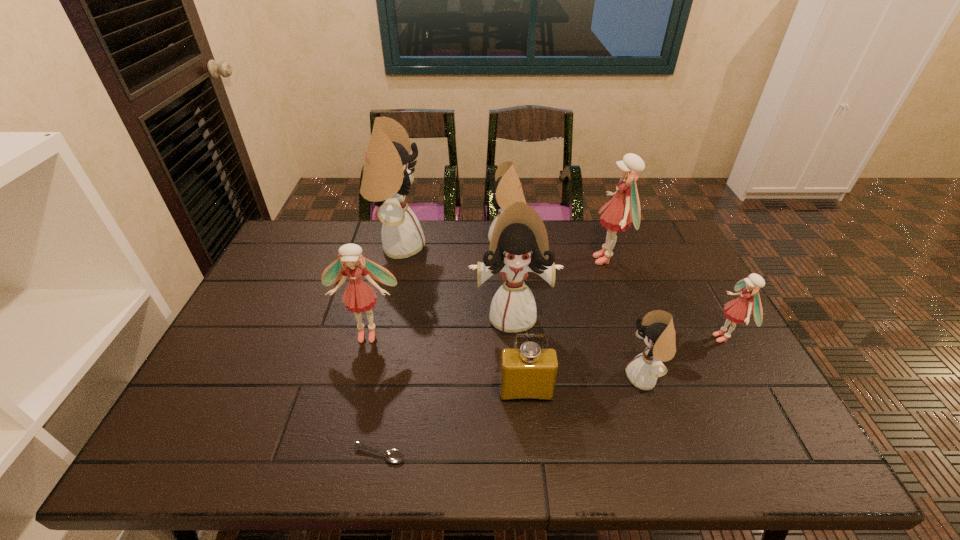
I want to click on doll that is the fourth nearest to the second shortest object, so click(624, 208).

Identify which doll is the closest to the tallest object. Please provide its 2D coordinates. Your answer should be formatted as a tuple, i.e. [(x, y)], where the tuple contains the x and y coordinates of a point satisfying the conditions above.

[(519, 244)]

Where is `black doll that is the nearest to the leftmost pink doll`? black doll that is the nearest to the leftmost pink doll is located at coordinates (519, 244).

This screenshot has width=960, height=540. Find the location of `black doll that stands as the fourth closest to the second biggest pink doll`. black doll that stands as the fourth closest to the second biggest pink doll is located at coordinates (657, 329).

What are the coordinates of `pink doll that can be found as the second closest to the second biggest black doll` in the screenshot? It's located at (359, 296).

Where is `pink doll object that ranks as the second closest to the second pink doll from right to left`? pink doll object that ranks as the second closest to the second pink doll from right to left is located at coordinates click(359, 296).

Image resolution: width=960 pixels, height=540 pixels. Find the location of `vacant position in the image that satisfies the following two spatial constraints: 1. at the front face of the second smallest black doll; 2. on the front-facing side of the second smallest pink doll`. vacant position in the image that satisfies the following two spatial constraints: 1. at the front face of the second smallest black doll; 2. on the front-facing side of the second smallest pink doll is located at coordinates (514, 333).

Identify the location of vacant space that satisfies the following two spatial constraints: 1. on the front-facing side of the second pink doll from right to left; 2. on the front-facing side of the second shortest object. (653, 393).